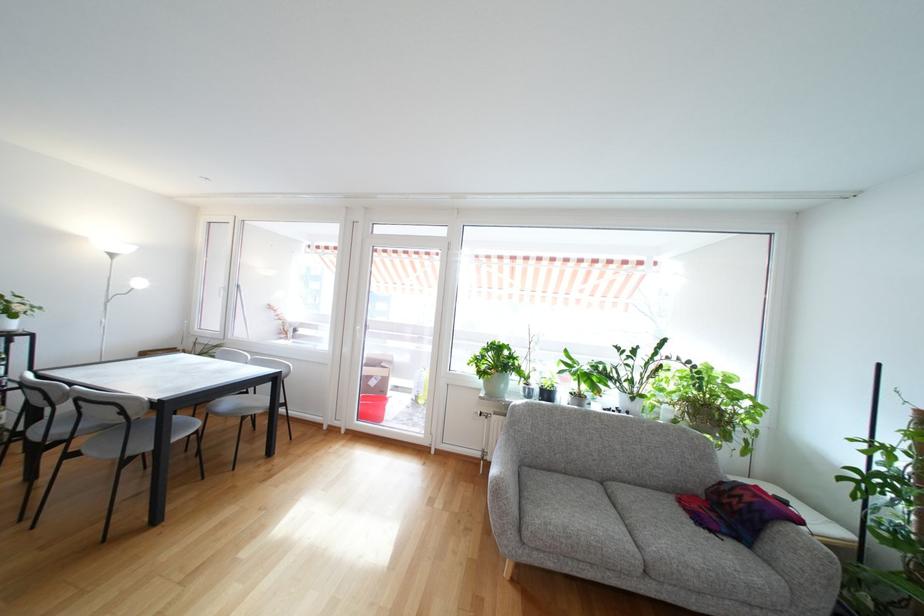
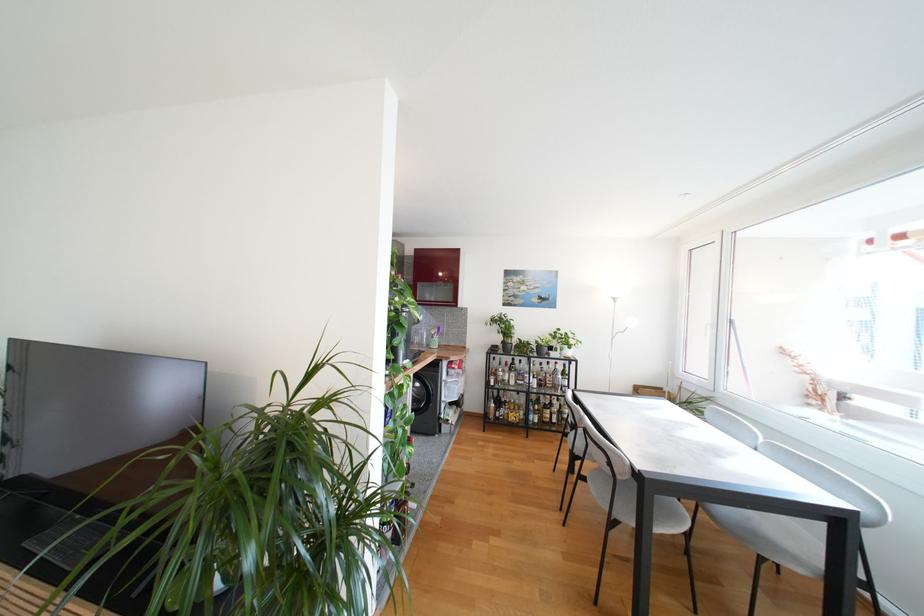
Question: Based on the continuous images, in which direction is the camera rotating? Reply with the corresponding letter.

Choices:
 (A) Left
 (B) Right
 (C) Up
 (D) Down

Answer: (A)